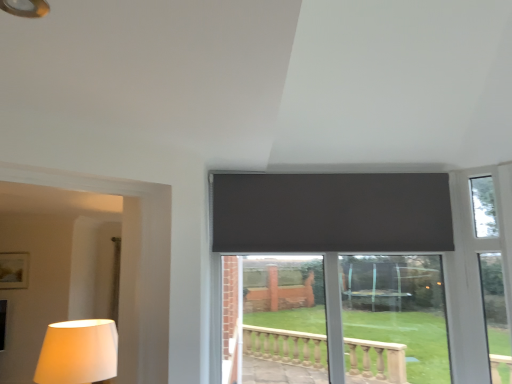
The image size is (512, 384). In order to click on white fabric lampshade at lower left in this screenshot , I will do `click(78, 352)`.

The width and height of the screenshot is (512, 384). What do you see at coordinates (78, 352) in the screenshot?
I see `white fabric lampshade at lower left` at bounding box center [78, 352].

Identify the location of white fabric lampshade at lower left. (78, 352).